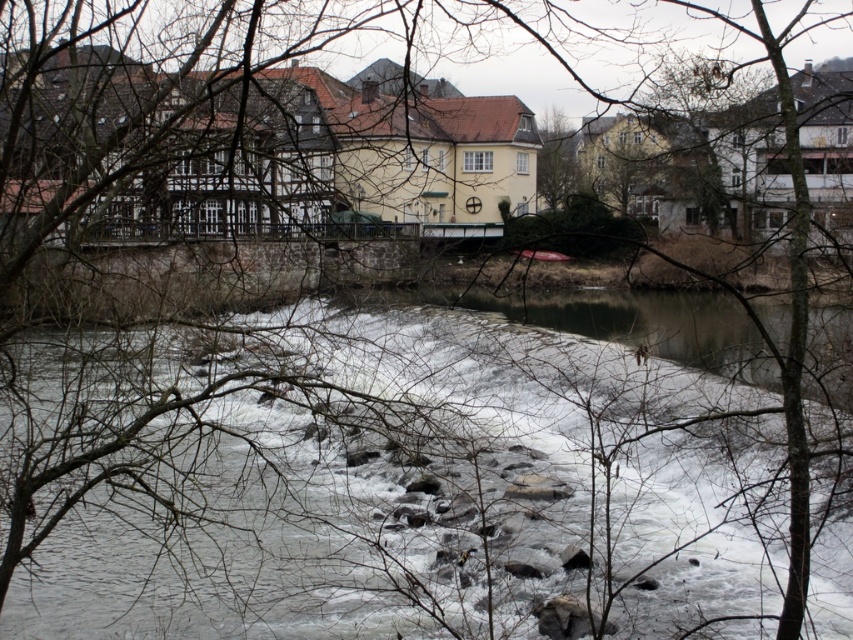
Question: Among these objects, which one is farthest from the camera?

Choices:
 (A) white frothy water at center
 (B) green leafy tree at upper center

Answer: (B)

Question: Does white frothy water at center have a smaller size compared to green leafy tree at upper center?

Choices:
 (A) yes
 (B) no

Answer: (B)

Question: Can you confirm if white frothy water at center is positioned above green leafy tree at upper center?

Choices:
 (A) yes
 (B) no

Answer: (B)

Question: Which point is closer to the camera?

Choices:
 (A) (576, 177)
 (B) (35, 403)

Answer: (B)

Question: Is white frothy water at center thinner than green leafy tree at upper center?

Choices:
 (A) no
 (B) yes

Answer: (A)